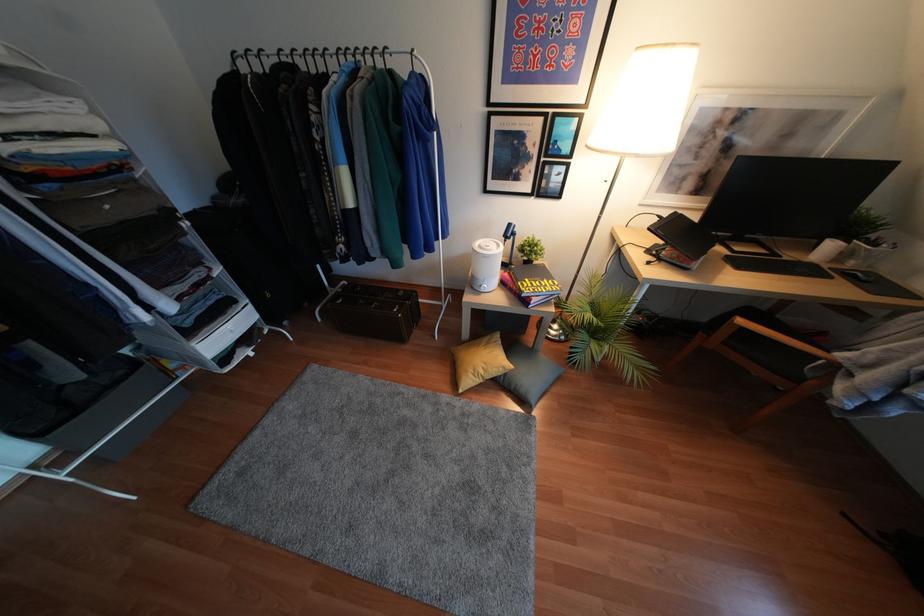
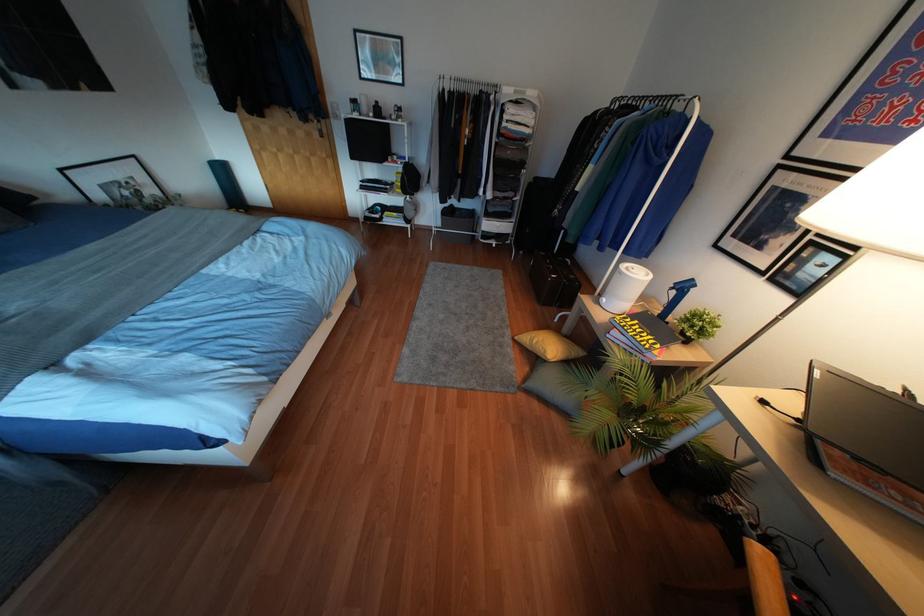
Find the pixel in the second image that matches (526,278) in the first image.

(637, 321)